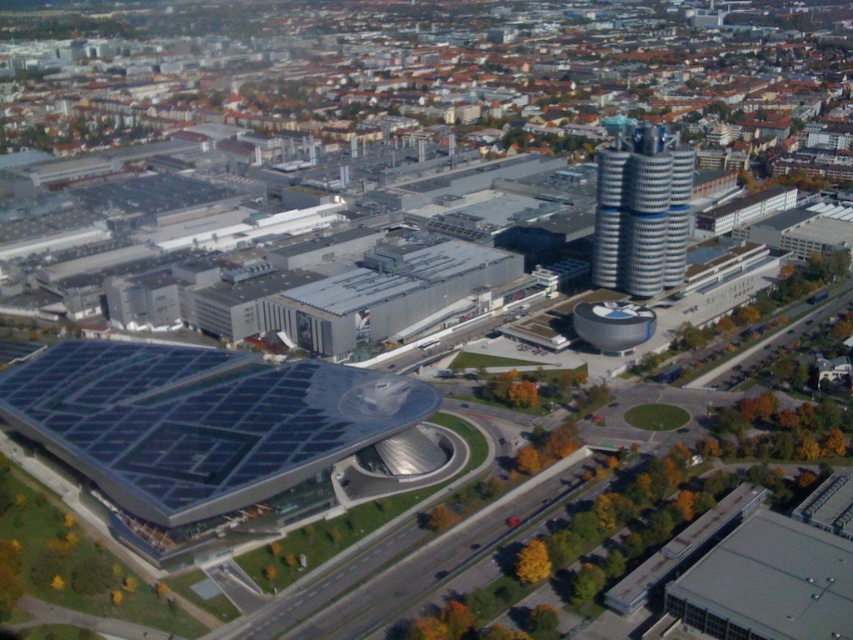
From the picture: You are a drone operator trying to capture aerial footage of the transparent glass roof at lower left and the silver metallic tower at upper right. From your current position above the exhibition center, which object will appear closer to the camera lens?

The transparent glass roof at lower left will appear closer to the camera lens because it is in front of the silver metallic tower at upper right.